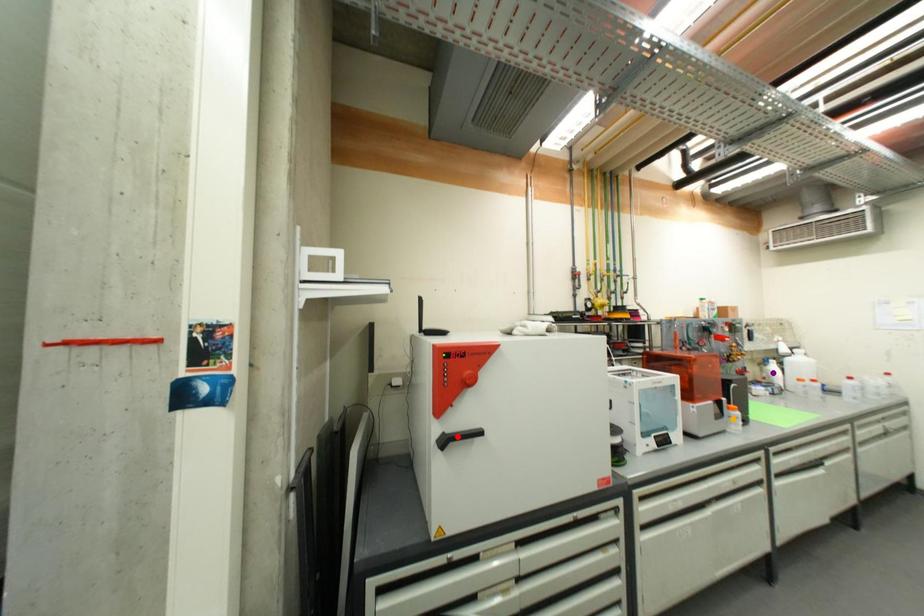
Order these from nearest to farthest:
A) purple point
B) red point
C) orange point

red point, orange point, purple point